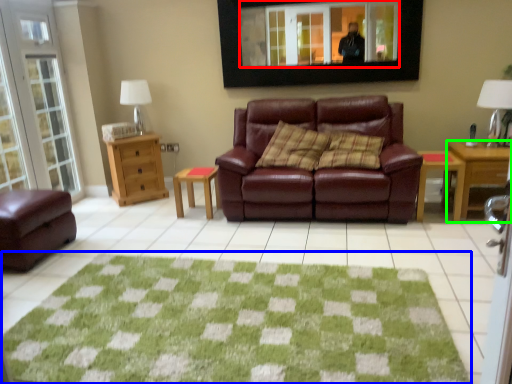
Question: Estimate the real-world distances between objects in this image. Which object is closer to mirror (highlighted by a red box), doormat (highlighted by a blue box) or desk (highlighted by a green box)?

Choices:
 (A) doormat
 (B) desk

Answer: (B)